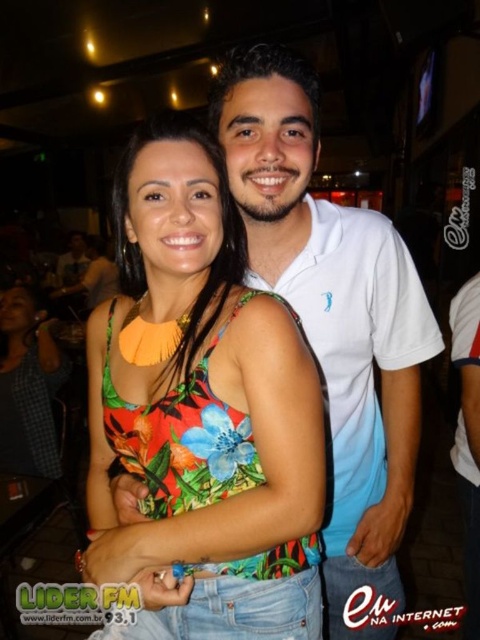
Question: Which point is farther to the camera?

Choices:
 (A) floral fabric top at center
 (B) white cotton polo shirt at center

Answer: (B)

Question: Among these points, which one is farthest from the camera?

Choices:
 (A) (435, 340)
 (B) (109, 564)

Answer: (A)

Question: Can you confirm if floral fabric top at center is thinner than white cotton polo shirt at center?

Choices:
 (A) yes
 (B) no

Answer: (B)

Question: Which point is farther to the camera?

Choices:
 (A) floral fabric top at center
 (B) white cotton polo shirt at center

Answer: (B)

Question: Can you confirm if floral fabric top at center is positioned to the left of white cotton polo shirt at center?

Choices:
 (A) yes
 (B) no

Answer: (A)

Question: Is floral fabric top at center closer to the viewer compared to white cotton polo shirt at center?

Choices:
 (A) no
 (B) yes

Answer: (B)